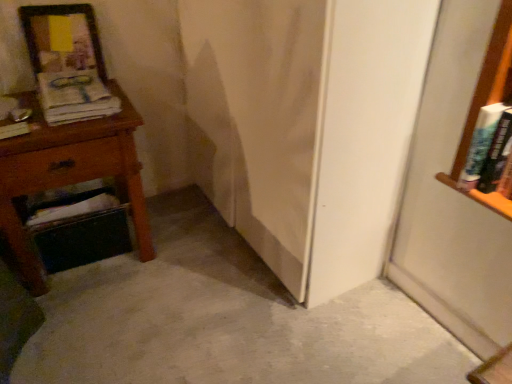
The width and height of the screenshot is (512, 384). Identify the location of vacant space to the right of hardcover book at left, which ranks as the second book in right-to-left order. (61, 134).